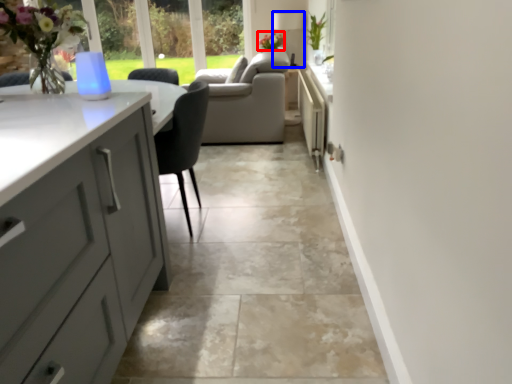
Question: Which point is closer to the camera, flower (highlighted by a red box) or lamp (highlighted by a blue box)?

Choices:
 (A) flower
 (B) lamp

Answer: (A)